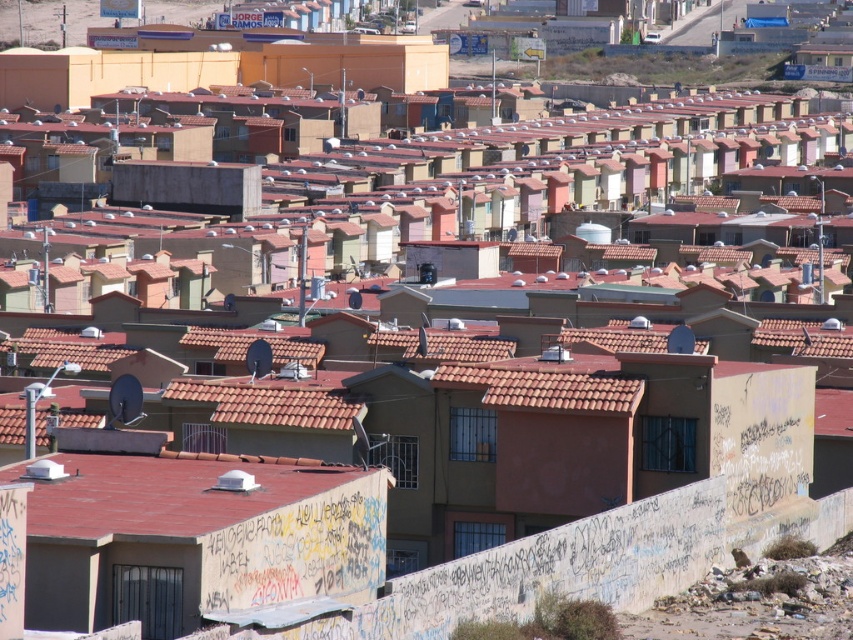
Question: Which point is farther to the camera?

Choices:
 (A) (500, 388)
 (B) (113, 484)

Answer: (A)

Question: From the image, what is the correct spatial relationship of red tile roof at lower left in relation to brown tile roof at center?

Choices:
 (A) right
 (B) left

Answer: (B)

Question: Can you confirm if red tile roof at lower left is wider than brown tile roof at center?

Choices:
 (A) no
 (B) yes

Answer: (B)

Question: Can you confirm if red tile roof at lower left is positioned to the left of brown tile roof at center?

Choices:
 (A) no
 (B) yes

Answer: (B)